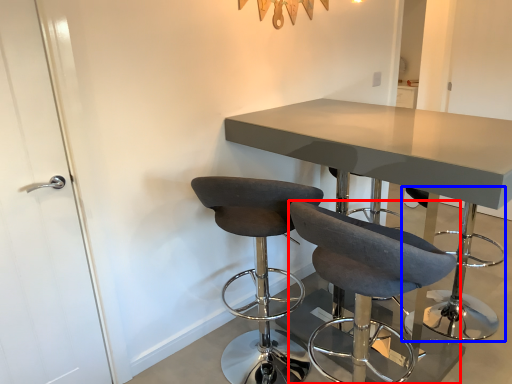
Question: Among these objects, which one is nearest to the camera, chair (highlighted by a red box) or bar stool (highlighted by a blue box)?

Choices:
 (A) chair
 (B) bar stool

Answer: (A)